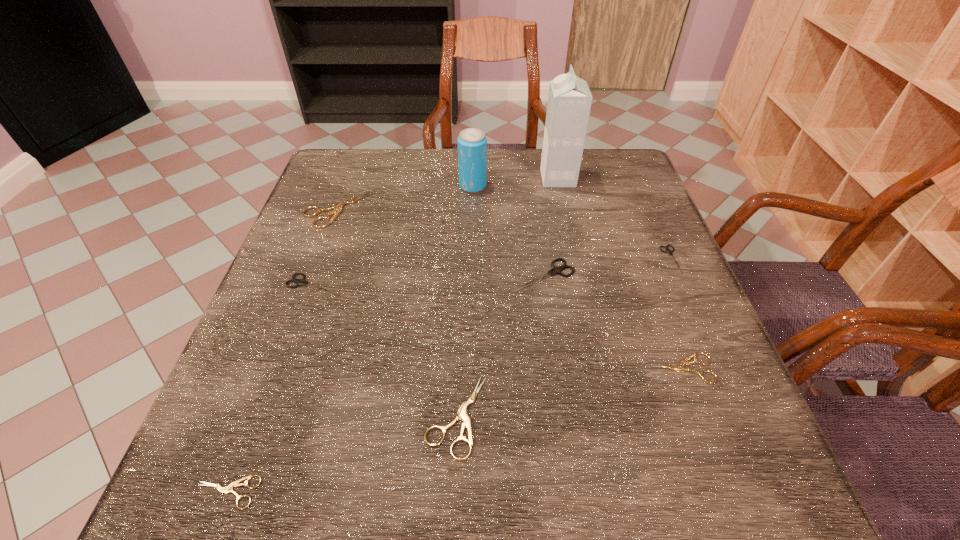
I want to click on blank region between the fifth shears from left to right and the rightmost black shears, so click(608, 267).

Locate an element on the screen. The image size is (960, 540). free space between the tallest object and the third biggest beige shears is located at coordinates (619, 273).

Where is `vacant region between the tallest object and the farthest shears`? The width and height of the screenshot is (960, 540). vacant region between the tallest object and the farthest shears is located at coordinates (447, 194).

At what (x,y) coordinates should I click in order to perform the action: click on free space between the second smallest beige shears and the rightmost black shears. Please return your answer as a coordinate pair (x, y). This screenshot has width=960, height=540. Looking at the image, I should click on (676, 314).

Identify the location of vacant space that's between the nearest shears and the eighth shortest object. (349, 339).

Choose which object is the second nearest neighbor to the smallest black shears. Please provide its 2D coordinates. Your answer should be formatted as a tuple, i.e. [(x, y)], where the tuple contains the x and y coordinates of a point satisfying the conditions above.

[(555, 270)]

Find the location of a particular element. This screenshot has width=960, height=540. object that ranks as the fourth closest to the smallest black shears is located at coordinates (472, 143).

Identify the location of shears that can be found as the fifth closest to the shortest shears. The width and height of the screenshot is (960, 540). (681, 367).

Select which shears is the fourth closest to the rightmost black shears. Please provide its 2D coordinates. Your answer should be formatted as a tuple, i.e. [(x, y)], where the tuple contains the x and y coordinates of a point satisfying the conditions above.

[(338, 207)]

Identify which black shears is the second nearest to the tallest object. Please provide its 2D coordinates. Your answer should be formatted as a tuple, i.e. [(x, y)], where the tuple contains the x and y coordinates of a point satisfying the conditions above.

[(555, 270)]